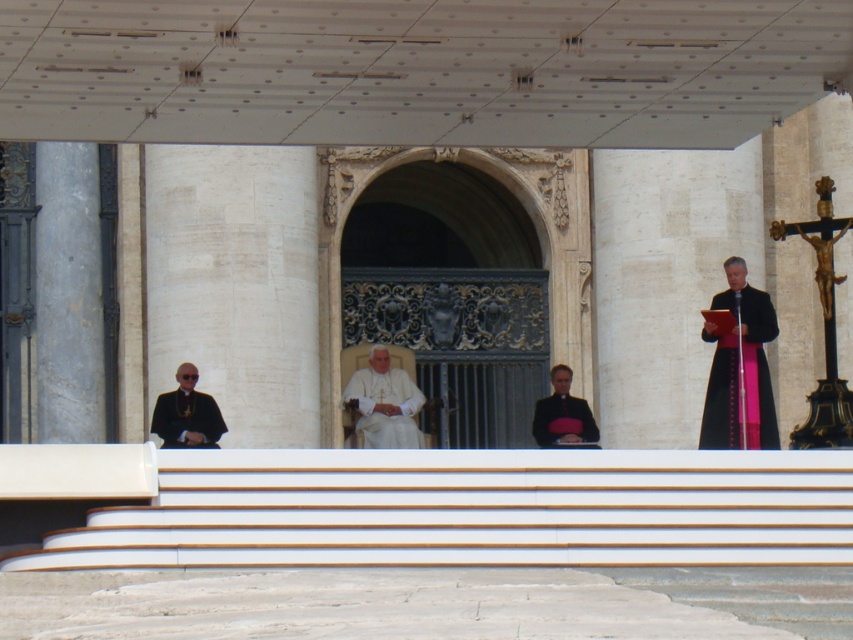
Question: Among these objects, which one is farthest from the camera?

Choices:
 (A) black satin robe at left
 (B) black satin robe at center

Answer: (B)

Question: Can you confirm if black velvet cassock at right is smaller than black satin robe at center?

Choices:
 (A) yes
 (B) no

Answer: (A)

Question: Which object is the farthest from the black velvet cassock at right?

Choices:
 (A) black satin robe at center
 (B) black satin robe at left

Answer: (B)

Question: Is black velvet cassock at right smaller than white matte/soft fabric at center?

Choices:
 (A) yes
 (B) no

Answer: (A)

Question: Which point is farther to the camera?

Choices:
 (A) (381, 356)
 (B) (537, 406)
 (C) (759, 372)
 (D) (212, 400)

Answer: (A)

Question: Does white matte/soft fabric at center come in front of black satin robe at center?

Choices:
 (A) yes
 (B) no

Answer: (B)